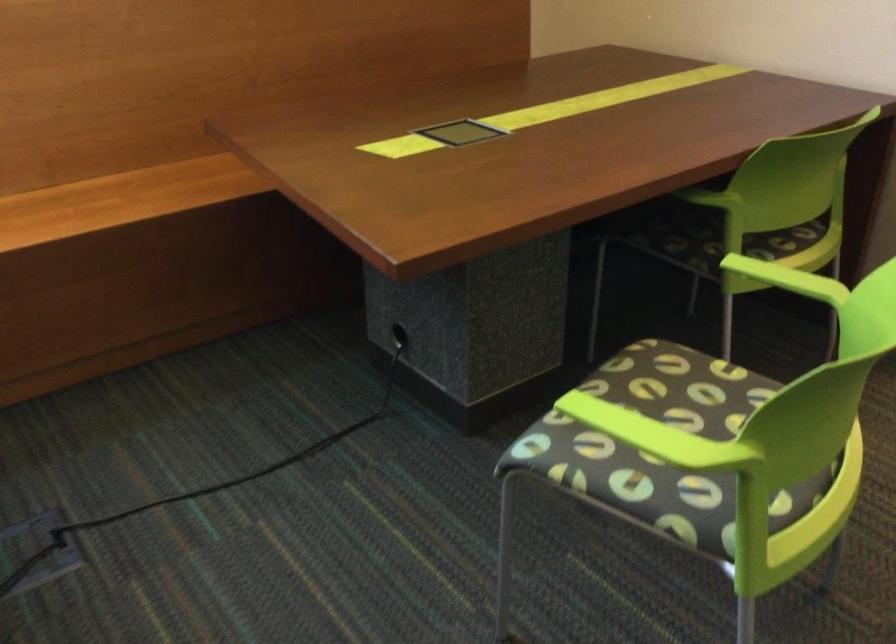
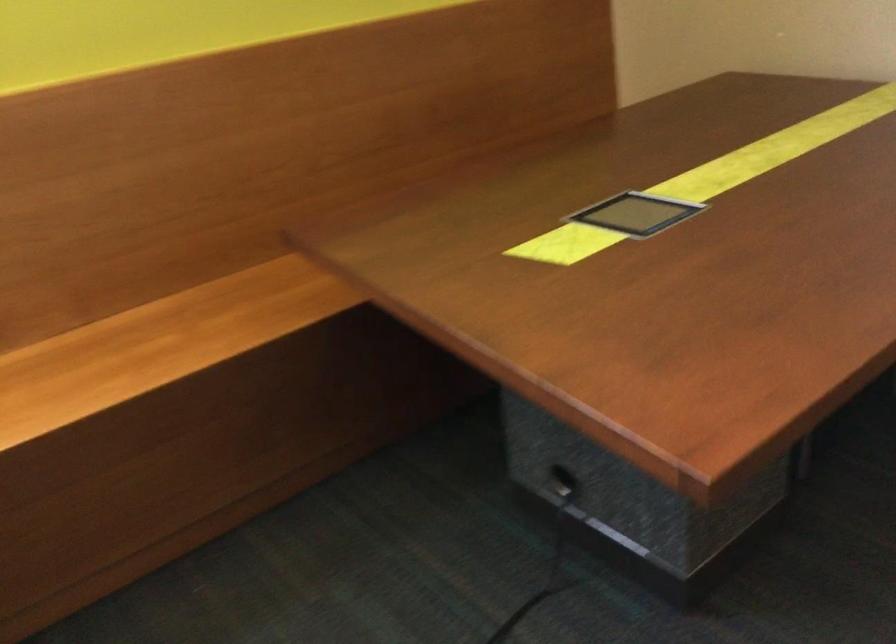
Question: The first image is from the beginning of the video and the second image is from the end. How did the camera likely rotate when shooting the video?

Choices:
 (A) Left
 (B) Right
 (C) Up
 (D) Down

Answer: (C)